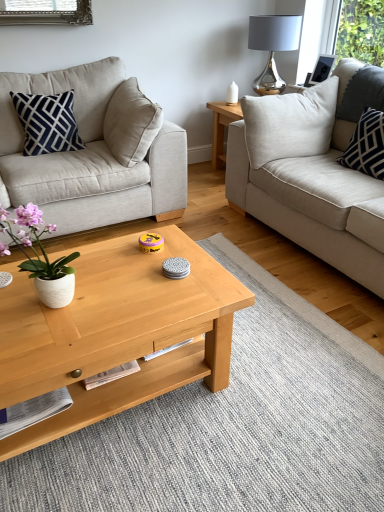
Question: Does white textured pillow at right, which appears as the second pillow when viewed from the left, contain shiny metallic lamp at upper right?

Choices:
 (A) no
 (B) yes

Answer: (A)

Question: Can we say white textured pillow at right, which appears as the second pillow when viewed from the left, lies outside shiny metallic lamp at upper right?

Choices:
 (A) no
 (B) yes

Answer: (B)

Question: From the image's perspective, would you say white textured pillow at right, positioned as the 1th pillow in right-to-left order, is shown under shiny metallic lamp at upper right?

Choices:
 (A) no
 (B) yes

Answer: (B)

Question: Is white textured pillow at right, which appears as the second pillow when viewed from the left, with shiny metallic lamp at upper right?

Choices:
 (A) yes
 (B) no

Answer: (B)

Question: Is shiny metallic lamp at upper right at the back of white textured pillow at right, which appears as the second pillow when viewed from the left?

Choices:
 (A) no
 (B) yes

Answer: (A)

Question: In terms of width, does white textured pillow at right, positioned as the 1th pillow in right-to-left order, look wider or thinner when compared to shiny metallic lamp at upper right?

Choices:
 (A) wide
 (B) thin

Answer: (B)

Question: In the image, is white textured pillow at right, positioned as the 1th pillow in right-to-left order, positioned in front of or behind shiny metallic lamp at upper right?

Choices:
 (A) behind
 (B) front

Answer: (B)

Question: Would you say white textured pillow at right, which appears as the second pillow when viewed from the left, is to the left or to the right of shiny metallic lamp at upper right in the picture?

Choices:
 (A) left
 (B) right

Answer: (B)

Question: From a real-world perspective, relative to shiny metallic lamp at upper right, is white textured pillow at right, positioned as the 1th pillow in right-to-left order, vertically above or below?

Choices:
 (A) below
 (B) above

Answer: (A)

Question: From a real-world perspective, is white ceramic pot at left above or below white textured pillow at right, positioned as the 1th pillow in right-to-left order?

Choices:
 (A) above
 (B) below

Answer: (A)

Question: Relative to white textured pillow at right, positioned as the 1th pillow in right-to-left order, is white ceramic pot at left in front or behind?

Choices:
 (A) behind
 (B) front

Answer: (B)

Question: Is white ceramic pot at left to the left or to the right of white textured pillow at right, positioned as the 1th pillow in right-to-left order, in the image?

Choices:
 (A) left
 (B) right

Answer: (A)

Question: Does point (59, 278) appear closer or farther from the camera than point (377, 122)?

Choices:
 (A) closer
 (B) farther

Answer: (A)

Question: Based on their positions, is light gray fabric couch at right, the second studio couch in the left-to-right sequence, located to the left or right of beige fabric couch at left, the first studio couch from the left?

Choices:
 (A) right
 (B) left

Answer: (A)

Question: Is light gray fabric couch at right, acting as the 1th studio couch starting from the right, inside the boundaries of beige fabric couch at left, the first studio couch from the left, or outside?

Choices:
 (A) inside
 (B) outside

Answer: (B)